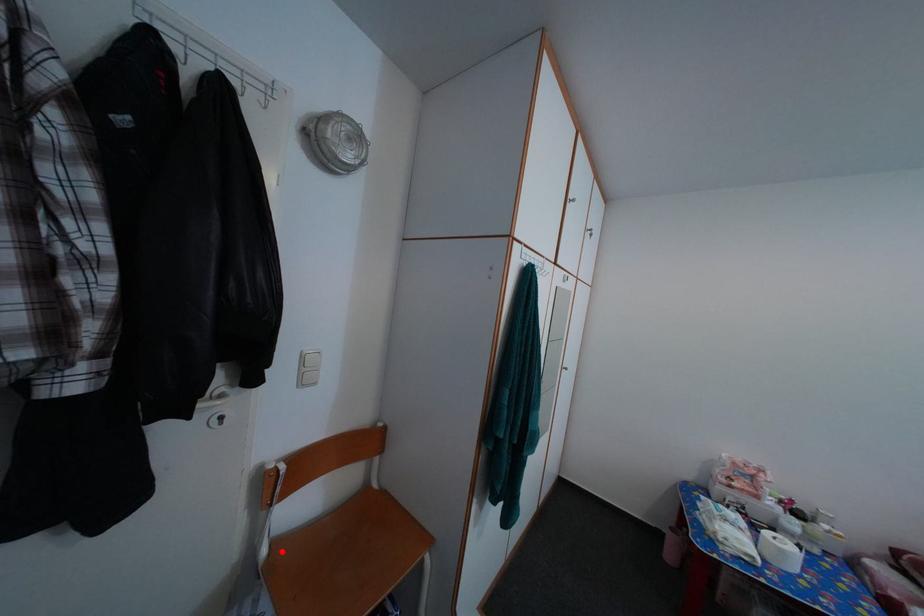
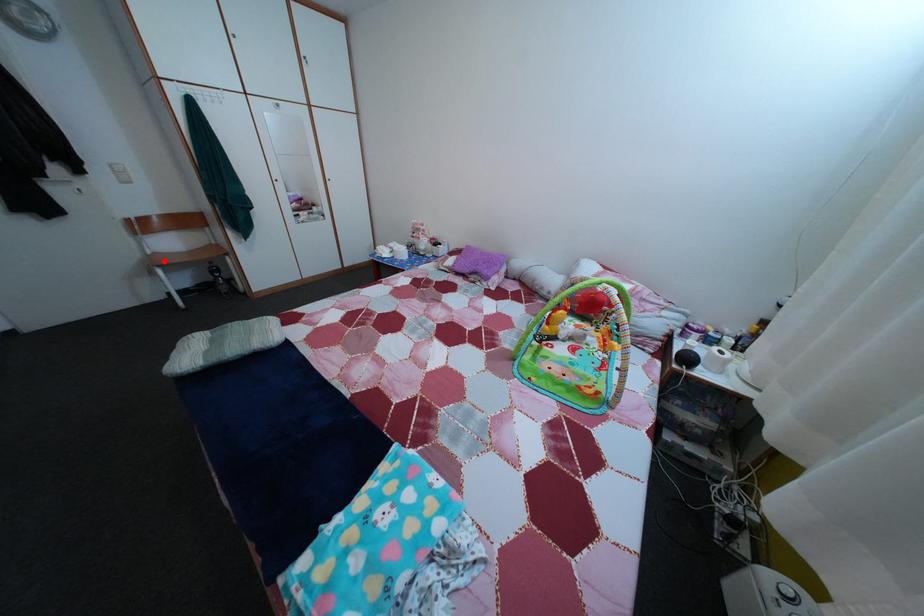
I am providing you with two images of the same scene from different viewpoints. A red point is marked on the first image and another point is marked on the second image. Is the red point in image1 aligned with the point shown in image2?

Yes